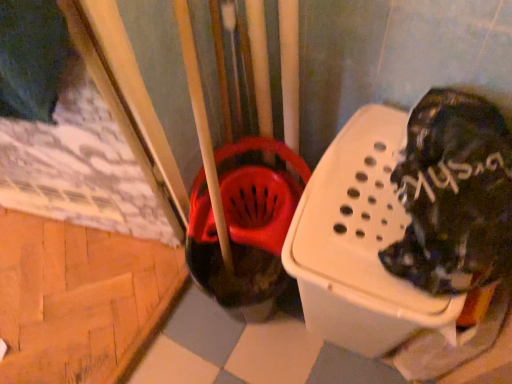
Image resolution: width=512 pixels, height=384 pixels. What do you see at coordinates (454, 195) in the screenshot? I see `plaid fabric shoe at upper right` at bounding box center [454, 195].

Identify the location of plaid fabric shoe at upper right. This screenshot has height=384, width=512. (454, 195).

I want to click on plaid fabric shoe at upper right, so click(x=454, y=195).